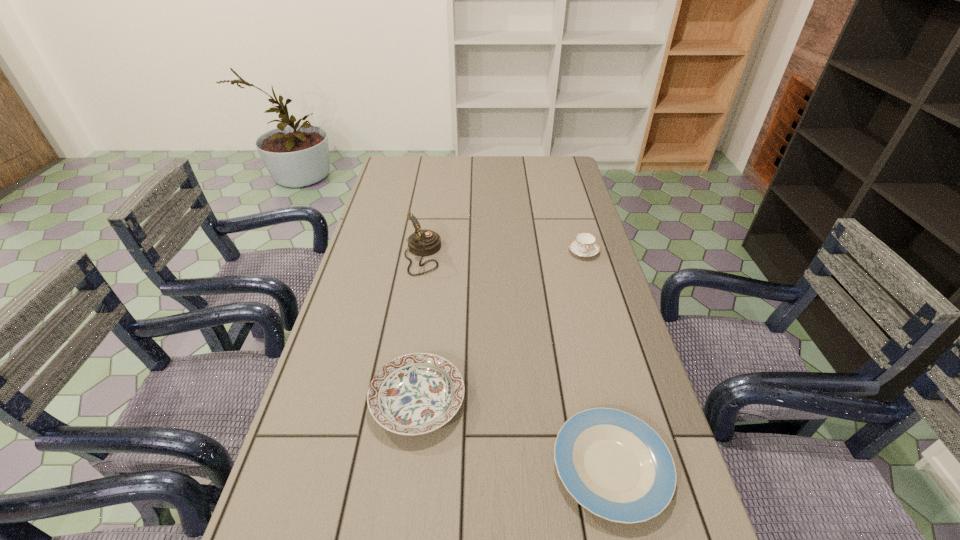
Locate an element on the screen. The width and height of the screenshot is (960, 540). telephone is located at coordinates (424, 242).

You are a GUI agent. You are given a task and a screenshot of the screen. Output one action in this format:
    pyautogui.click(x=<x>, y=<y>)
    Task: Click on the teacup
    The image size is (960, 540).
    Given the screenshot: What is the action you would take?
    pyautogui.click(x=584, y=245)

Identify the location of the taller plate. (414, 394).

Find the location of a particular element. the third tallest object is located at coordinates (414, 394).

Locate an element on the screen. The width and height of the screenshot is (960, 540). the shorter plate is located at coordinates (615, 465).

This screenshot has width=960, height=540. In order to click on the shortest object in this screenshot , I will do `click(615, 465)`.

You are a GUI agent. You are given a task and a screenshot of the screen. Output one action in this format:
    pyautogui.click(x=<x>, y=<y>)
    Task: Click on the vacant point located 0.050m on the back of the tallest object
    
    Given the screenshot: What is the action you would take?
    pyautogui.click(x=426, y=228)

You are a GUI agent. You are given a task and a screenshot of the screen. Output one action in this format:
    pyautogui.click(x=<x>, y=<y>)
    Task: Click on the vacant space located 0.360m on the side with the handle of the teacup
    
    Given the screenshot: What is the action you would take?
    pyautogui.click(x=612, y=349)

The height and width of the screenshot is (540, 960). Find the location of `free space located on the front of the third tallest object`. free space located on the front of the third tallest object is located at coordinates (404, 509).

Image resolution: width=960 pixels, height=540 pixels. Identify the location of vacant space located on the left of the right plate. (493, 467).